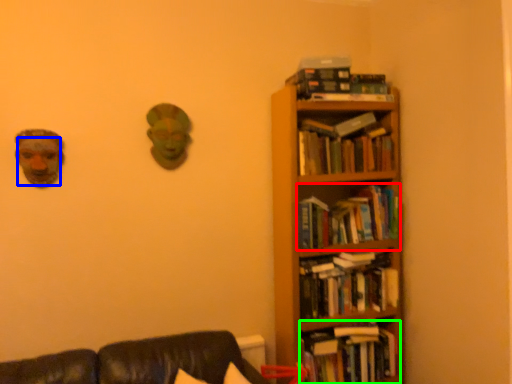
Question: Which object is the farthest from book (highlighted by a red box)? Choose among these: human face (highlighted by a blue box) or book (highlighted by a green box).

Choices:
 (A) human face
 (B) book

Answer: (A)